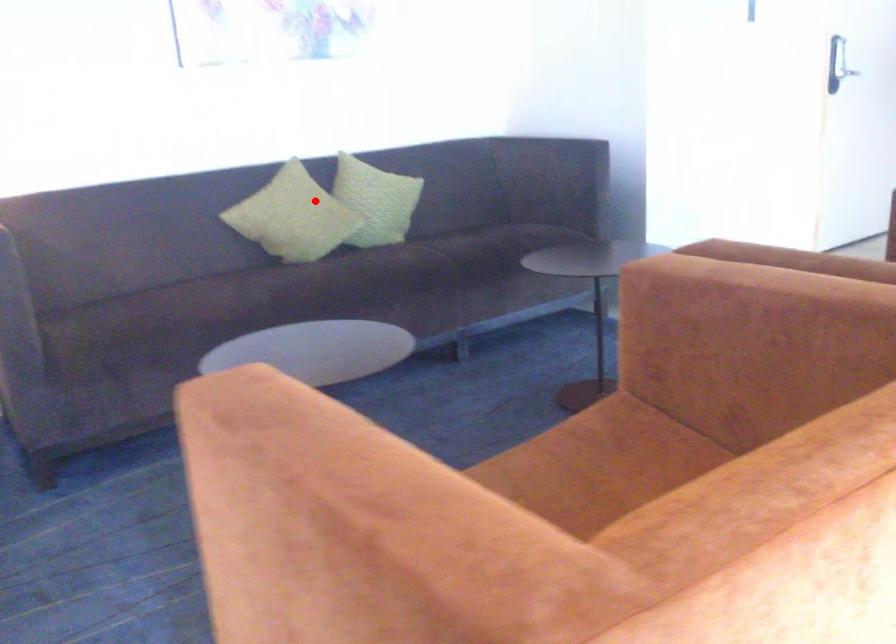
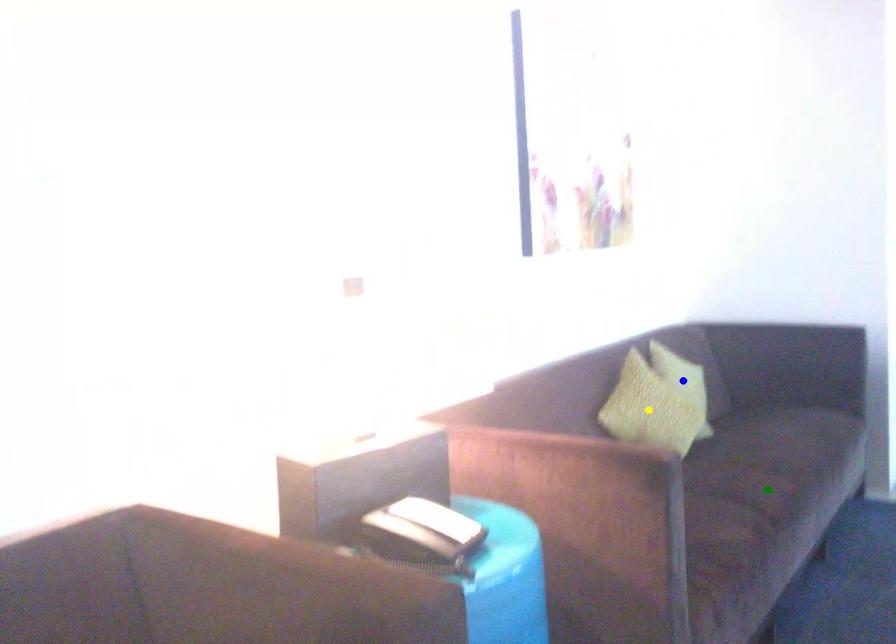
Question: I am providing you with two images of the same scene from different viewpoints. A red point is marked on the first image. You are given multiple points on the second image. Which point in image 2 is actually the same real-world point as the red point in image 1?

Choices:
 (A) yellow point
 (B) blue point
 (C) green point

Answer: (B)